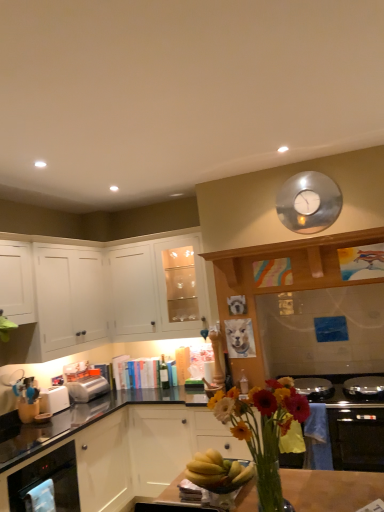
Measure the distance between satin silver toaster at lower left, the first toaster from the back, and camera.

The depth of satin silver toaster at lower left, the first toaster from the back, is 3.70 meters.

What do you see at coordinates (97, 294) in the screenshot? I see `white matte cabinet at left, the 2th cabinetry in the top-to-bottom sequence` at bounding box center [97, 294].

This screenshot has width=384, height=512. What do you see at coordinates (48, 478) in the screenshot?
I see `stainless steel oven at lower left` at bounding box center [48, 478].

Measure the distance between white plastic toaster at lower left, the 2th toaster in the back-to-front sequence, and camera.

The depth of white plastic toaster at lower left, the 2th toaster in the back-to-front sequence, is 3.29 meters.

In order to face white plastic toaster at lower left, the 1th toaster from the front, should I rotate leftwards or rightwards?

Rotate left and turn 18.035 degrees.

Locate an element on the screen. The height and width of the screenshot is (512, 384). satin silver toaster at lower left, the first toaster from the back is located at coordinates (88, 388).

Is the depth of silver metallic clock at upper center greater than that of white matte cabinet at upper left, the first cabinetry viewed from the top?

No, the depth of silver metallic clock at upper center is less than that of white matte cabinet at upper left, the first cabinetry viewed from the top.

Based on the photo, from a real-world perspective, does silver metallic clock at upper center sit lower than white matte cabinet at upper left, the first cabinetry viewed from the top?

Actually, silver metallic clock at upper center is physically above white matte cabinet at upper left, the first cabinetry viewed from the top, in the real world.

Considering the sizes of objects silver metallic clock at upper center and white matte cabinet at upper left, the third cabinetry from the bottom, in the image provided, who is smaller, silver metallic clock at upper center or white matte cabinet at upper left, the third cabinetry from the bottom,?

Smaller between the two is silver metallic clock at upper center.

Considering the positions of point (300, 223) and point (143, 312), is point (300, 223) closer or farther from the camera than point (143, 312)?

Point (300, 223) is positioned closer to the camera compared to point (143, 312).

From the picture: Which object is positioned more to the left, stainless steel oven at lower left or translucent glass vase at center?

stainless steel oven at lower left is more to the left.

Considering the sizes of objects stainless steel oven at lower left and translucent glass vase at center in the image provided, who is thinner, stainless steel oven at lower left or translucent glass vase at center?

Thinner between the two is translucent glass vase at center.

There is a stainless steel oven at lower left. Where is `floral arrangement above it (from a real-world perspective)`? The height and width of the screenshot is (512, 384). floral arrangement above it (from a real-world perspective) is located at coordinates (263, 430).

Consider the image. Is stainless steel oven at lower left oriented away from satin silver toaster at lower left, the first toaster from the back?

No, stainless steel oven at lower left's orientation is not away from satin silver toaster at lower left, the first toaster from the back.

Is stainless steel oven at lower left not near satin silver toaster at lower left, acting as the 2th toaster starting from the front?

Absolutely, stainless steel oven at lower left is distant from satin silver toaster at lower left, acting as the 2th toaster starting from the front.

Is point (65, 461) more distant than point (76, 397)?

No, it is in front of (76, 397).

Based on their sizes in the image, would you say stainless steel oven at lower left is bigger or smaller than satin silver toaster at lower left, the first toaster from the back?

Considering their sizes, stainless steel oven at lower left takes up more space than satin silver toaster at lower left, the first toaster from the back.

Considering the points (302, 228) and (274, 379), which point is in front, point (302, 228) or point (274, 379)?

Positioned in front is point (302, 228).

What's the angular difference between silver metallic clock at upper center and translucent glass vase at center's facing directions?

silver metallic clock at upper center and translucent glass vase at center are facing 0.015 degrees away from each other.

Is silver metallic clock at upper center not within translucent glass vase at center?

Yes.

From the image's perspective, is silver metallic clock at upper center below translucent glass vase at center?

No.

Considering the sizes of objects white matte cabinet at left, positioned as the second cabinetry in bottom-to-top order, and satin silver toaster at lower left, the first toaster from the back, in the image provided, who is taller, white matte cabinet at left, positioned as the second cabinetry in bottom-to-top order, or satin silver toaster at lower left, the first toaster from the back,?

With more height is white matte cabinet at left, positioned as the second cabinetry in bottom-to-top order.

Is satin silver toaster at lower left, acting as the 2th toaster starting from the front, at the back of white matte cabinet at left, the 2th cabinetry in the top-to-bottom sequence?

That's not correct — white matte cabinet at left, the 2th cabinetry in the top-to-bottom sequence, is not looking away from satin silver toaster at lower left, acting as the 2th toaster starting from the front.

Is white matte cabinet at left, positioned as the second cabinetry in bottom-to-top order, completely or partially outside of satin silver toaster at lower left, acting as the 2th toaster starting from the front?

Yes, white matte cabinet at left, positioned as the second cabinetry in bottom-to-top order, is not within satin silver toaster at lower left, acting as the 2th toaster starting from the front.

From a real-world perspective, is white matte cabinet at left, positioned as the second cabinetry in bottom-to-top order, physically located above or below satin silver toaster at lower left, acting as the 2th toaster starting from the front?

From a real-world perspective, white matte cabinet at left, positioned as the second cabinetry in bottom-to-top order, is physically above satin silver toaster at lower left, acting as the 2th toaster starting from the front.

From the image's perspective, starting from the stainless steel oven at lower left, which toaster is the 1st one above? Please provide its 2D coordinates.

[(88, 388)]

Is point (87, 397) farther from viewer compared to point (30, 466)?

Yes, point (87, 397) is farther from viewer.

Do you think satin silver toaster at lower left, the first toaster from the back, is within stainless steel oven at lower left, or outside of it?

The correct answer is: outside.

Between white matte cabinet at upper left, the third cabinetry from the bottom, and stainless steel oven at lower left, which one appears on the right side from the viewer's perspective?

From the viewer's perspective, white matte cabinet at upper left, the third cabinetry from the bottom, appears more on the right side.

The height and width of the screenshot is (512, 384). I want to click on kitchen appliance directly beneath the white matte cabinet at upper left, the third cabinetry from the bottom (from a real-world perspective), so click(x=48, y=478).

Is white matte cabinet at upper left, the first cabinetry viewed from the top, shorter than stainless steel oven at lower left?

In fact, white matte cabinet at upper left, the first cabinetry viewed from the top, may be taller than stainless steel oven at lower left.

Would you consider white matte cabinet at upper left, the third cabinetry from the bottom, to be distant from stainless steel oven at lower left?

That's right, there is a large distance between white matte cabinet at upper left, the third cabinetry from the bottom, and stainless steel oven at lower left.

Where is `the 1st cabinetry positioned below the silver metallic clock at upper center (from a real-world perspective)`? The width and height of the screenshot is (384, 512). the 1st cabinetry positioned below the silver metallic clock at upper center (from a real-world perspective) is located at coordinates (158, 288).

Identify the location of kitchen appliance that is on the left side of translucent glass vase at center. (48, 478).

Estimate the real-world distances between objects in this image. Which object is closer to satin silver toaster at lower left, acting as the 2th toaster starting from the front, stainless steel oven at lower left or translucent glass vase at center?

stainless steel oven at lower left.

From the image, which object appears to be nearer to white matte cabinet at left, the 2th cabinetry in the top-to-bottom sequence, white plastic toaster at lower left, the 1th toaster from the front, or satin silver toaster at lower left, the first toaster from the back?

satin silver toaster at lower left, the first toaster from the back, is closer to white matte cabinet at left, the 2th cabinetry in the top-to-bottom sequence.

Which object lies nearer to the anchor point white matte cabinet at left, which is the third cabinetry from top to bottom, stainless steel oven at lower left or silver metallic clock at upper center?

stainless steel oven at lower left lies closer to white matte cabinet at left, which is the third cabinetry from top to bottom, than the other object.

From the image, which object appears to be farther from stainless steel oven at lower left, satin silver toaster at lower left, the first toaster from the back, or white matte cabinet at upper left, the third cabinetry from the bottom?

Based on the image, white matte cabinet at upper left, the third cabinetry from the bottom, appears to be further to stainless steel oven at lower left.

Estimate the real-world distances between objects in this image. Which object is closer to silver metallic clock at upper center, translucent glass vase at center or white matte cabinet at left, positioned as the second cabinetry in bottom-to-top order?

Among the two, white matte cabinet at left, positioned as the second cabinetry in bottom-to-top order, is located nearer to silver metallic clock at upper center.

Based on the photo, considering their positions, is white plastic toaster at lower left, the 1th toaster from the front, positioned closer to white matte cabinet at left, positioned as the second cabinetry in bottom-to-top order, than white matte cabinet at upper left, the third cabinetry from the bottom?

white matte cabinet at upper left, the third cabinetry from the bottom, lies closer to white matte cabinet at left, positioned as the second cabinetry in bottom-to-top order, than the other object.

Considering their positions, is white plastic toaster at lower left, the 2th toaster in the back-to-front sequence, positioned further to translucent glass vase at center than silver metallic clock at upper center?

Among the two, white plastic toaster at lower left, the 2th toaster in the back-to-front sequence, is located further to translucent glass vase at center.

Looking at the image, which one is located further to white matte cabinet at upper left, the first cabinetry viewed from the top, white matte cabinet at left, positioned as the second cabinetry in bottom-to-top order, or white matte cabinet at left, which is the first cabinetry in bottom-to-top order?

The object further to white matte cabinet at upper left, the first cabinetry viewed from the top, is white matte cabinet at left, which is the first cabinetry in bottom-to-top order.

Image resolution: width=384 pixels, height=512 pixels. I want to click on kitchen appliance between translucent glass vase at center and white plastic toaster at lower left, the 1th toaster from the front, from front to back, so click(48, 478).

You are a GUI agent. You are given a task and a screenshot of the screen. Output one action in this format:
    pyautogui.click(x=<x>, y=<y>)
    Task: Click on the cabinetry positioned between white matte cabinet at left, the 2th cabinetry in the top-to-bottom sequence, and satin silver toaster at lower left, the first toaster from the back, from near to far
    Image resolution: width=384 pixels, height=512 pixels.
    Given the screenshot: What is the action you would take?
    pyautogui.click(x=158, y=288)

This screenshot has width=384, height=512. What are the coordinates of `floral arrangement located between stainless steel oven at lower left and silver metallic clock at upper center in the left-right direction` in the screenshot? It's located at (263, 430).

The height and width of the screenshot is (512, 384). I want to click on toaster that lies between white matte cabinet at upper left, the third cabinetry from the bottom, and satin silver toaster at lower left, the first toaster from the back, from top to bottom, so click(53, 399).